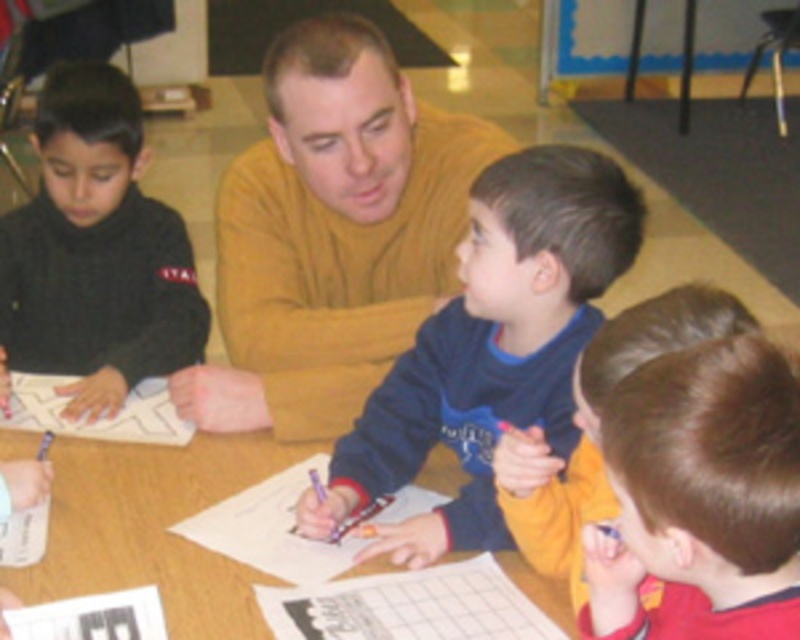
You are a student sitting at the table in the classroom. You need to place a small sticker on the object with the smaller width between the brown hair at lower right and the black matte sweater at left. Which object should you choose?

The brown hair at lower right has a lesser width compared to the black matte sweater at left, so you should place the sticker on the brown hair at lower right.

You are a student in the classroom looking at the table. Which sweater is closer to the floor, the blue fleece sweater at center or the black matte sweater at left?

The blue fleece sweater at center is closer to the floor because it is positioned below the black matte sweater at left.